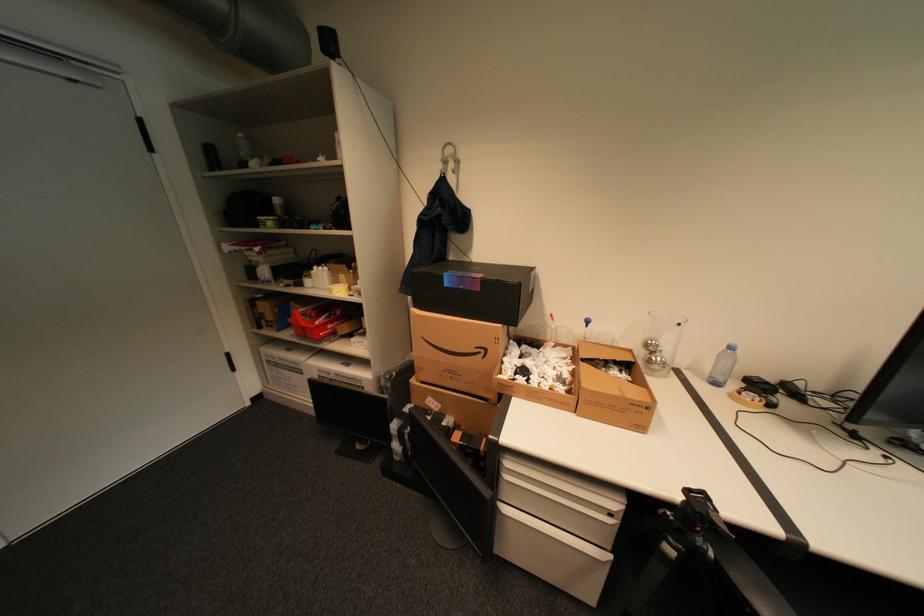
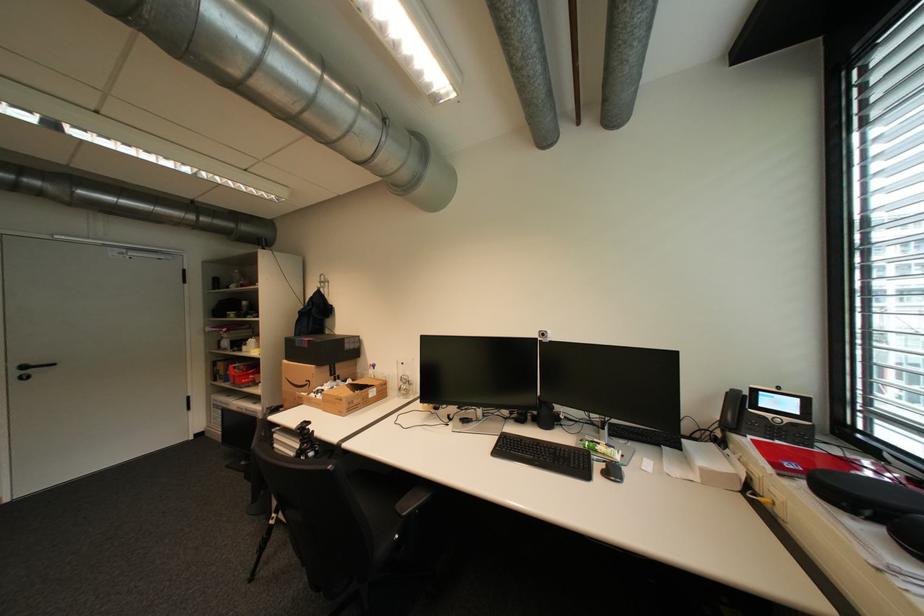
In a continuous first-person perspective shot, in which direction is the camera moving?

The movement direction of the cameraman is right, backward.